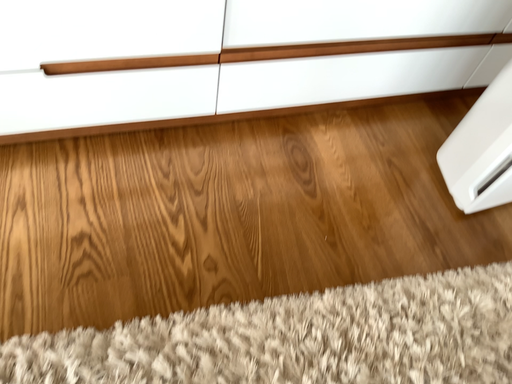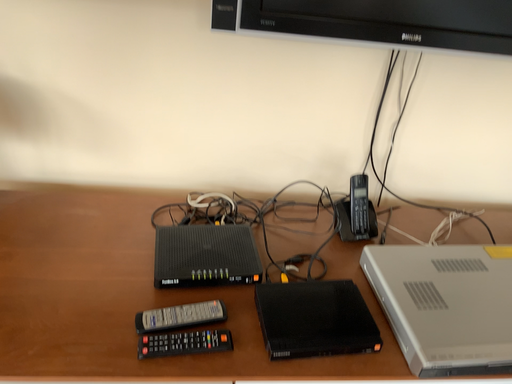
Question: Which way did the camera rotate in the video?

Choices:
 (A) rotated right
 (B) rotated left

Answer: (B)